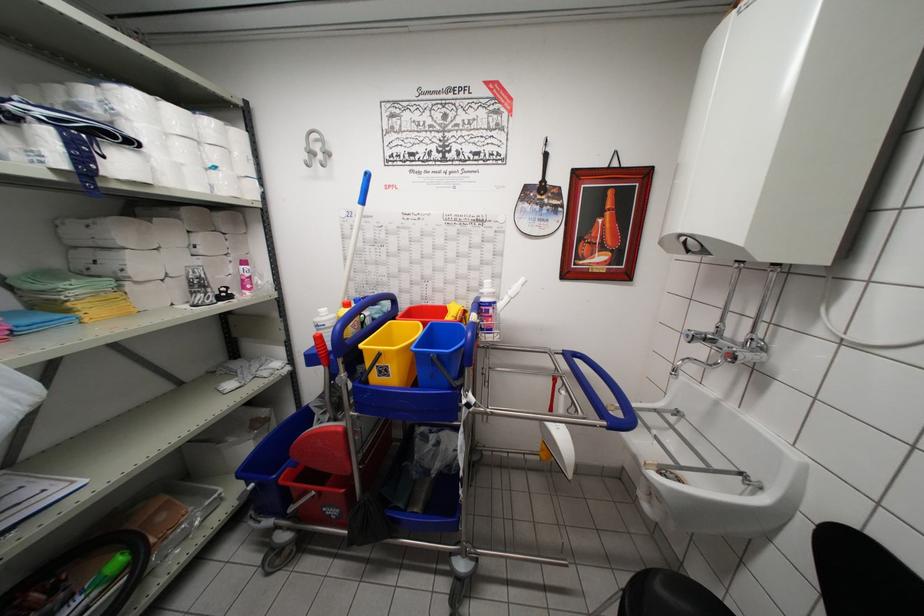
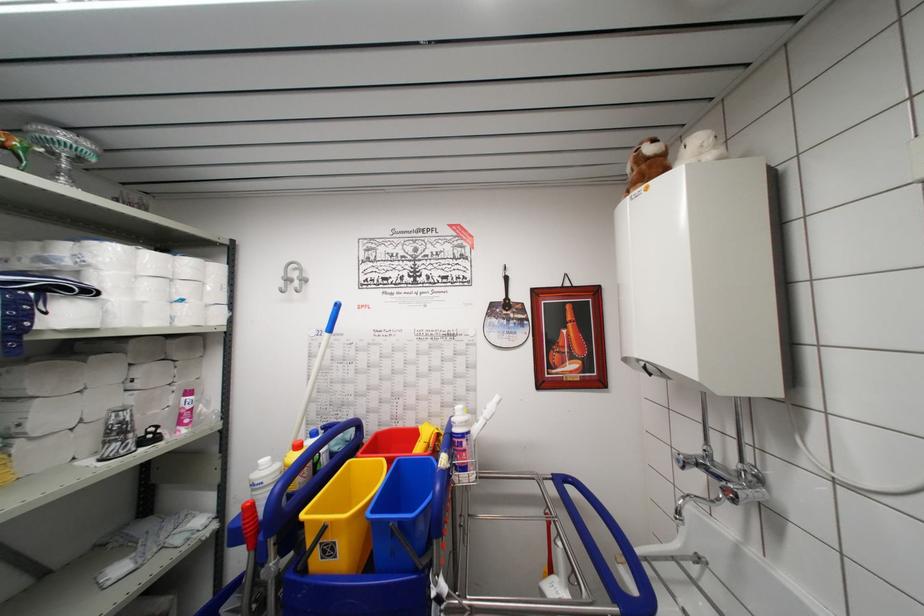
Locate, in the second image, the point that corresponds to pixel 466 313 in the first image.

(439, 436)